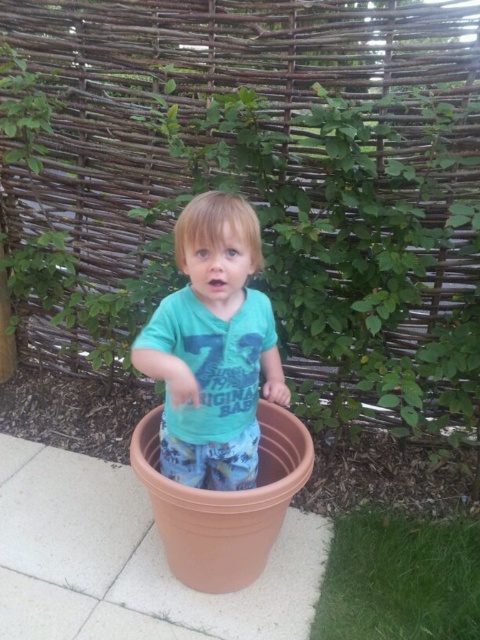
Between point (380, 387) and point (177, 388), which one is positioned in front?

Positioned in front is point (177, 388).

Can you confirm if matte terracotta pot at center is positioned to the right of green matte shirt at center?

Correct, you'll find matte terracotta pot at center to the right of green matte shirt at center.

Is point (406, 246) farther from camera compared to point (204, 198)?

That is True.

The width and height of the screenshot is (480, 640). I want to click on matte terracotta pot at center, so click(x=346, y=248).

Which is above, green grass at lower right or green leafy plant at upper left?

Positioned higher is green leafy plant at upper left.

Is point (450, 618) positioned behind point (12, 84)?

No, it is not.

The image size is (480, 640). Find the location of `green grass at lower right`. green grass at lower right is located at coordinates (399, 579).

Which is more to the left, matte terracotta pot at center or green grass at lower right?

matte terracotta pot at center is more to the left.

Who is shorter, matte terracotta pot at center or green grass at lower right?

Standing shorter between the two is green grass at lower right.

From the picture: Who is more distant from viewer, (159, 262) or (422, 557)?

The point (159, 262) is behind.

Identify the location of matte terracotta pot at center. (346, 248).